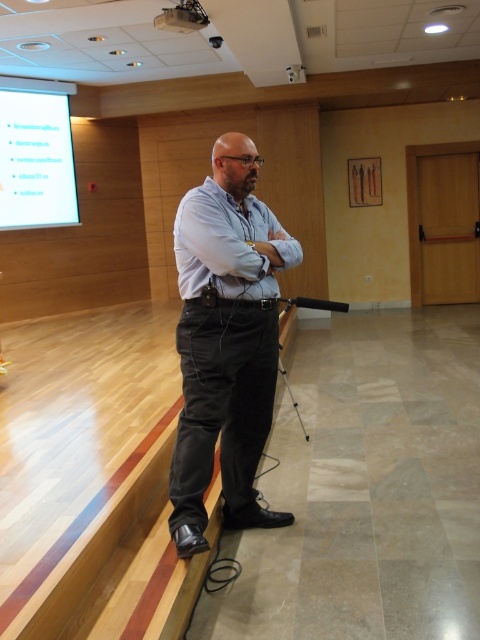
Question: From the image, what is the correct spatial relationship of white glossy projection screen at upper left in relation to white plastic projector at upper center?

Choices:
 (A) below
 (B) above

Answer: (A)

Question: Which is nearer to the white plastic projector at upper center?

Choices:
 (A) white glossy projection screen at upper left
 (B) dark gray corduroy pants at center

Answer: (B)

Question: Among these points, which one is nearest to the camera?

Choices:
 (A) (195, 29)
 (B) (200, 196)

Answer: (B)

Question: Among these objects, which one is farthest from the camera?

Choices:
 (A) dark gray corduroy pants at center
 (B) white plastic projector at upper center
 (C) white glossy projection screen at upper left

Answer: (C)

Question: Can you confirm if white glossy projection screen at upper left is thinner than white plastic projector at upper center?

Choices:
 (A) yes
 (B) no

Answer: (B)

Question: Is white glossy projection screen at upper left wider than white plastic projector at upper center?

Choices:
 (A) no
 (B) yes

Answer: (B)